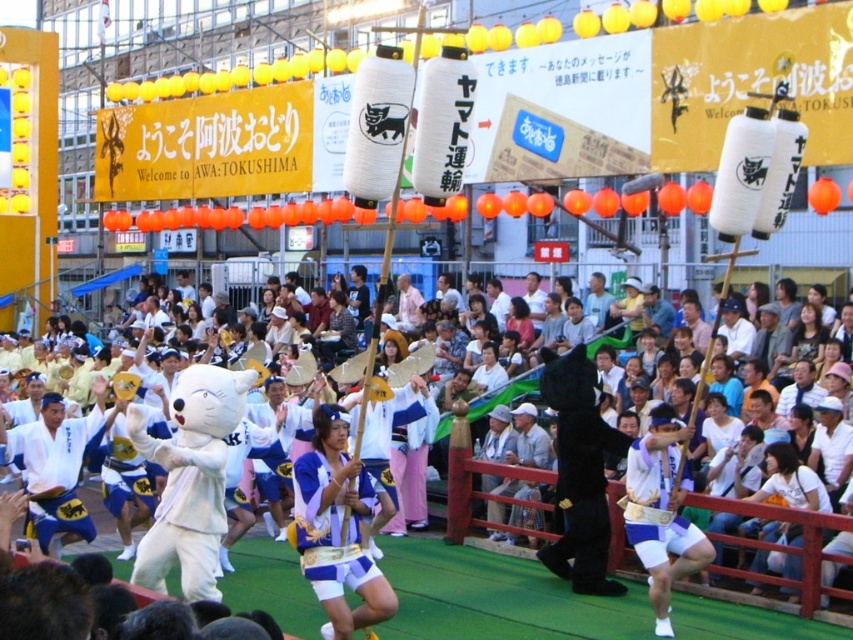
Who is more forward, (581, 630) or (399, 275)?

Point (581, 630) is in front.

Does white plush mascot at center appear on the left side of white cotton kimono at center?

Yes, white plush mascot at center is to the left of white cotton kimono at center.

Who is more forward, (x=747, y=616) or (x=405, y=310)?

Positioned in front is point (x=747, y=616).

I want to click on white plush mascot at center, so click(x=497, y=598).

Does blue fabric costume at center have a lesser height compared to white fabric mask at center?

Correct, blue fabric costume at center is not as tall as white fabric mask at center.

Image resolution: width=853 pixels, height=640 pixels. What are the coordinates of `blue fabric costume at center` in the screenshot? It's located at (335, 529).

Where is `blue fabric costume at center`? This screenshot has width=853, height=640. blue fabric costume at center is located at coordinates (335, 529).

The image size is (853, 640). Identify the location of white plush mascot at center. (497, 598).

Does white plush mascot at center have a lesser height compared to blue fabric costume at center?

Incorrect, white plush mascot at center's height does not fall short of blue fabric costume at center's.

Locate an element on the screen. white plush mascot at center is located at coordinates (x=497, y=598).

The image size is (853, 640). I want to click on white plush mascot at center, so click(497, 598).